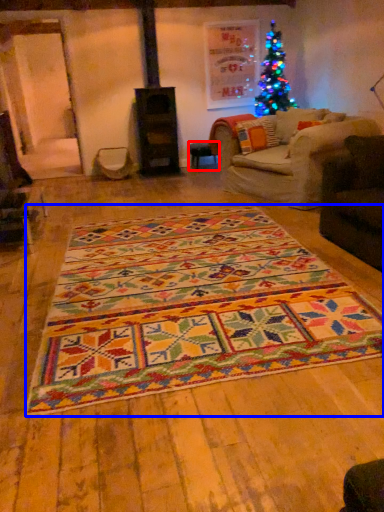
Question: Which of the following is the closest to the observer, table (highlighted by a red box) or mat (highlighted by a blue box)?

Choices:
 (A) table
 (B) mat

Answer: (B)